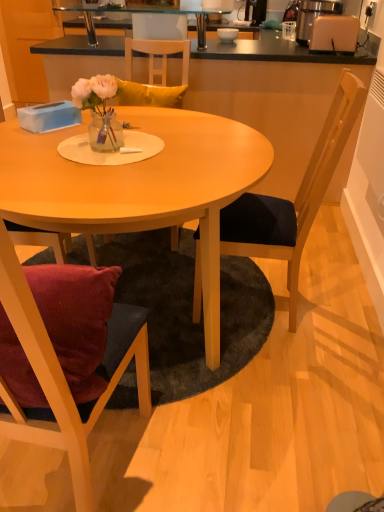
Where is `empty space that is ontop of matte wood table at center (from a real-world perspective)`? empty space that is ontop of matte wood table at center (from a real-world perspective) is located at coordinates (134, 156).